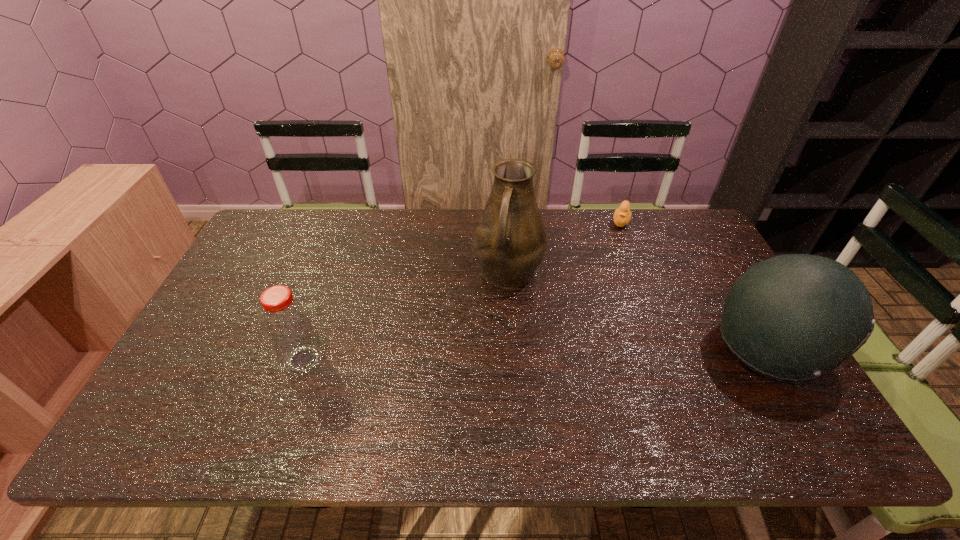
Identify the location of free point located 0.270m on the face of the shortest object. (605, 280).

The image size is (960, 540). I want to click on vacant position located 0.310m on the face of the shortest object, so click(x=603, y=288).

Identify the location of vacant point located on the handle side of the tallest object. The image size is (960, 540). (478, 379).

What are the coordinates of `free space located on the handle side of the tallest object` in the screenshot? It's located at (483, 363).

This screenshot has width=960, height=540. Find the location of `vacant area situated on the handle side of the tallest object`. vacant area situated on the handle side of the tallest object is located at coordinates (494, 325).

Where is `duckling present at the far edge`? This screenshot has height=540, width=960. duckling present at the far edge is located at coordinates (622, 215).

At what (x,y) coordinates should I click in order to perform the action: click on pitcher located at the far edge. Please return your answer as a coordinate pair (x, y). Looking at the image, I should click on (510, 240).

Where is `bottle situated at the near edge`? This screenshot has height=540, width=960. bottle situated at the near edge is located at coordinates (287, 324).

Where is `football helmet that is at the near edge`? football helmet that is at the near edge is located at coordinates [x=794, y=317].

The image size is (960, 540). Find the location of `object that is at the right edge`. object that is at the right edge is located at coordinates click(794, 317).